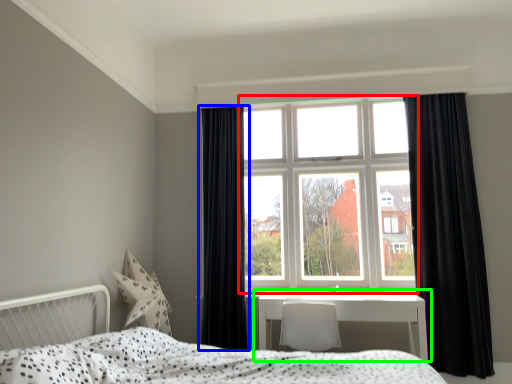
Question: Estimate the real-world distances between objects in this image. Which object is closer to window (highlighted by a red box), curtain (highlighted by a blue box) or table (highlighted by a green box)?

Choices:
 (A) curtain
 (B) table

Answer: (A)